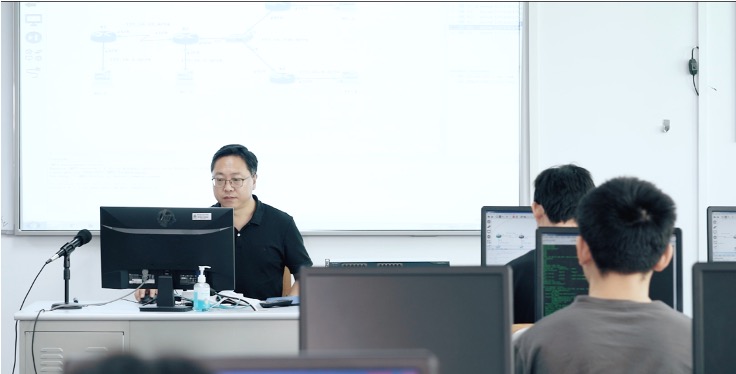
Where is `hand sanitizer`? hand sanitizer is located at coordinates (198, 297).